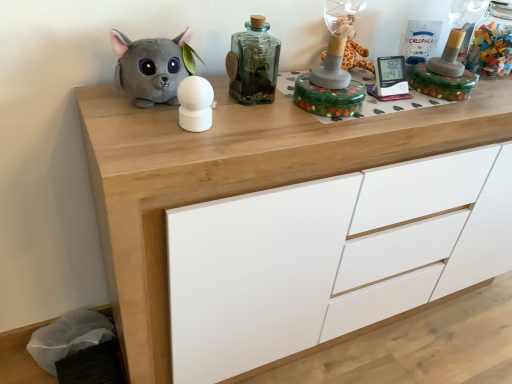
The height and width of the screenshot is (384, 512). Identify the location of vacant space that is to the left of green floral box at center, acting as the 1th toy starting from the right. (265, 106).